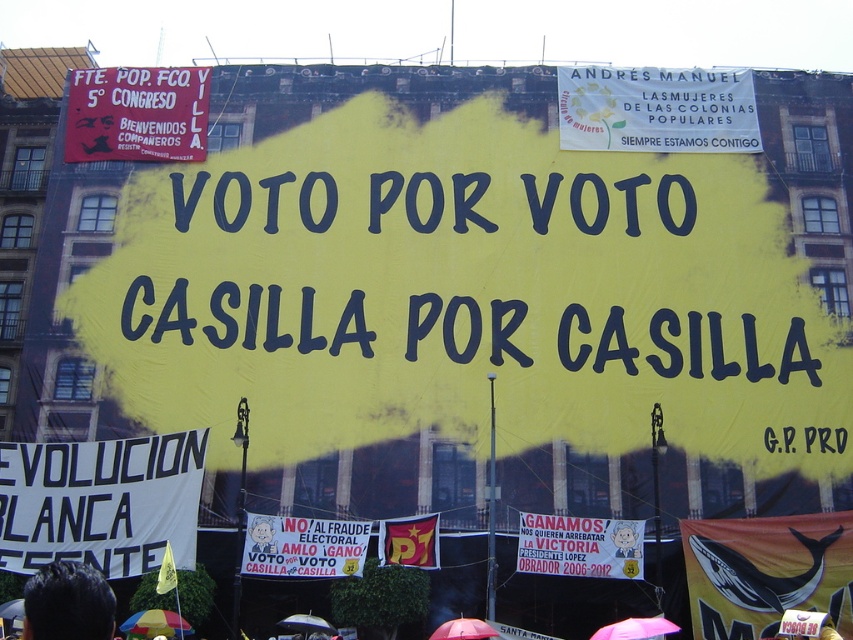
Question: Considering the real-world distances, which object is closest to the yellow paper at center?

Choices:
 (A) white paper banner at upper center
 (B) yellow fabric banner at center
 (C) white paper banner at center

Answer: (A)

Question: Which object appears closest to the camera in this image?

Choices:
 (A) red fabric banner at upper left
 (B) black hair at lower left
 (C) white paper banner at upper center

Answer: (B)

Question: Considering the relative positions of yellow paper at center and red fabric banner at upper left in the image provided, where is yellow paper at center located with respect to red fabric banner at upper left?

Choices:
 (A) left
 (B) right

Answer: (B)

Question: Estimate the real-world distances between objects in this image. Which object is farther from the white fabric banner at lower left?

Choices:
 (A) red fabric banner at upper left
 (B) orange fabric whale at lower right

Answer: (B)

Question: Is yellow paper at center above white paper banner at lower center?

Choices:
 (A) yes
 (B) no

Answer: (A)

Question: Is white paper banner at upper center below white paper banner at center?

Choices:
 (A) no
 (B) yes

Answer: (A)